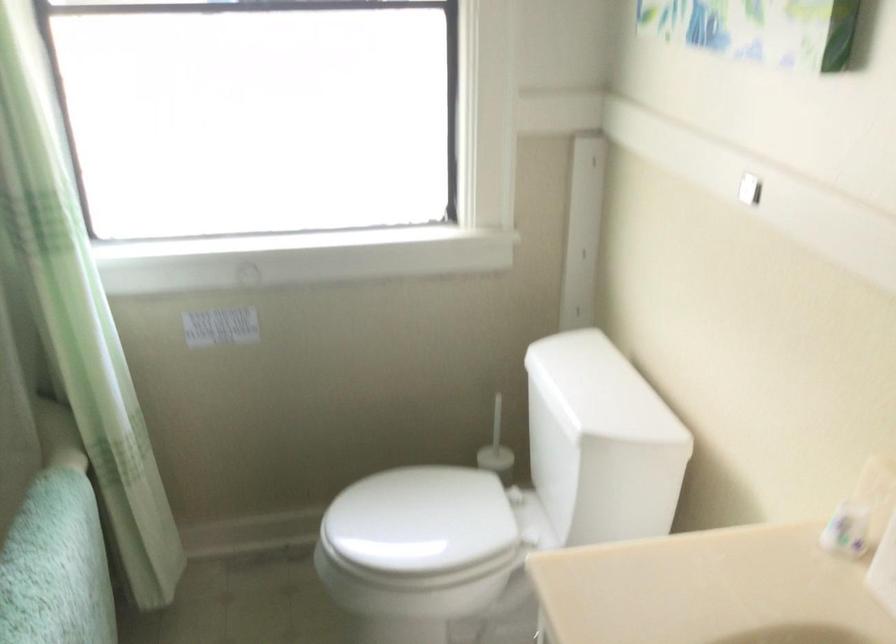
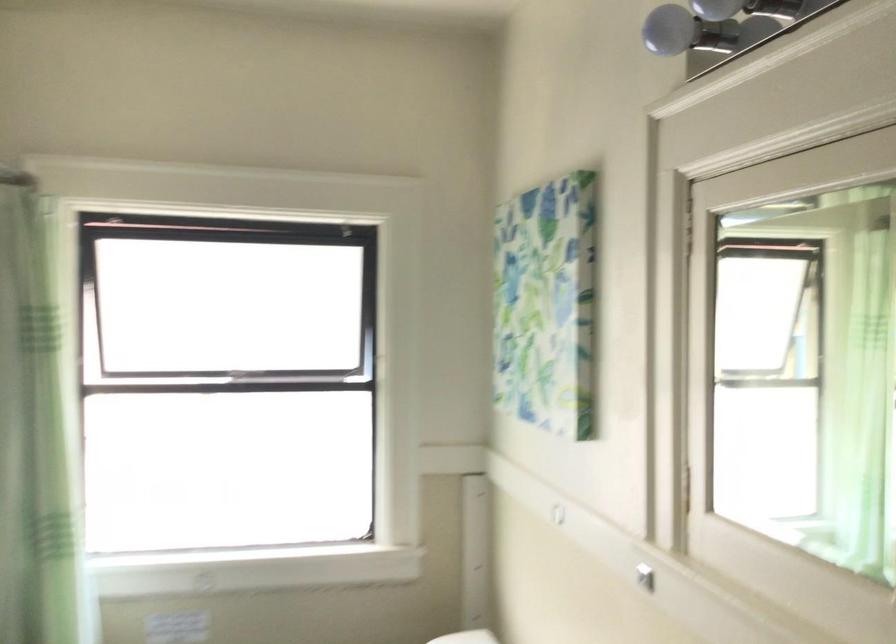
Question: Based on the continuous images, in which direction is the camera rotating? Reply with the corresponding letter.

Choices:
 (A) Left
 (B) Right
 (C) Up
 (D) Down

Answer: (C)